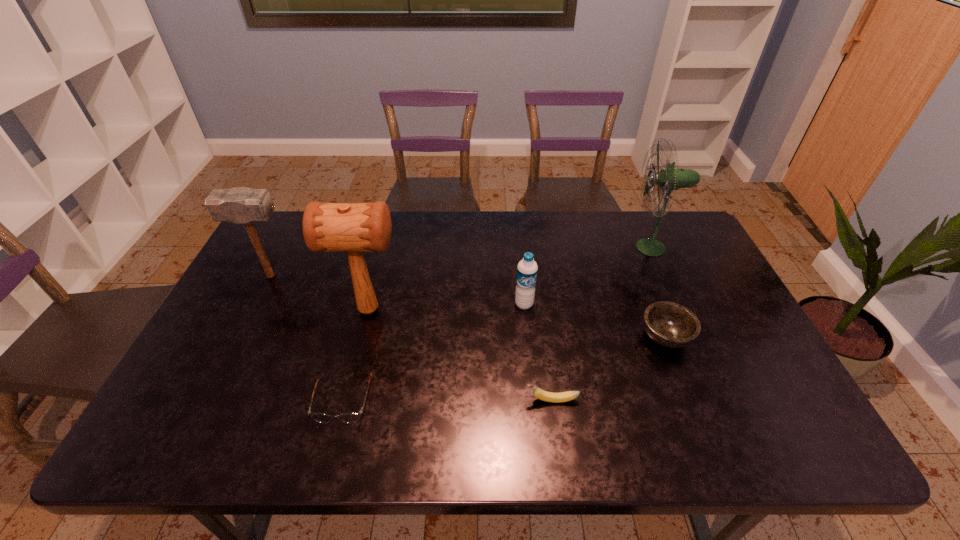
At what (x,y) coordinates should I click in order to perform the action: click on free location located on the front-facing side of the fan. Please return your answer as a coordinate pair (x, y). Image resolution: width=960 pixels, height=540 pixels. Looking at the image, I should click on (603, 247).

Where is `vacant space located 0.150m on the front-facing side of the fan`? vacant space located 0.150m on the front-facing side of the fan is located at coordinates (585, 247).

The height and width of the screenshot is (540, 960). I want to click on free space located 0.180m on the strike surface of the right mallet, so click(x=468, y=310).

At what (x,y) coordinates should I click in order to perform the action: click on free space located 0.220m on the striking face of the leftmost object. Please return your answer as a coordinate pair (x, y). Image resolution: width=960 pixels, height=540 pixels. Looking at the image, I should click on (367, 276).

Where is `free space located on the label of the fourth shortest object`? Image resolution: width=960 pixels, height=540 pixels. free space located on the label of the fourth shortest object is located at coordinates (537, 435).

Where is `free location located on the right of the bowl`? Image resolution: width=960 pixels, height=540 pixels. free location located on the right of the bowl is located at coordinates (736, 337).

Where is `vacant space situated 0.260m at the stem of the banana`? The height and width of the screenshot is (540, 960). vacant space situated 0.260m at the stem of the banana is located at coordinates (416, 400).

Locate an element on the screen. vacant space located 0.080m at the stem of the banana is located at coordinates (492, 400).

At what (x,y) coordinates should I click in order to perform the action: click on vacant space located 0.350m at the stem of the banana. Please return your answer as a coordinate pair (x, y). The height and width of the screenshot is (540, 960). Looking at the image, I should click on (377, 400).

Identify the location of object that is at the far edge. (668, 179).